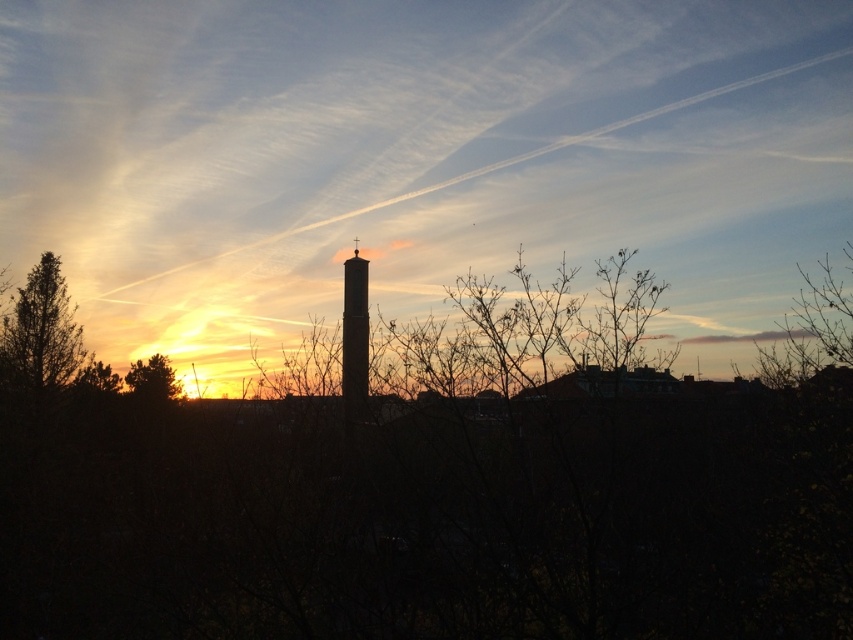
Question: Can you confirm if green textured tree at left is positioned above bare branches at right?

Choices:
 (A) no
 (B) yes

Answer: (A)

Question: Does bare branches at right have a smaller size compared to green leafy tree at left?

Choices:
 (A) yes
 (B) no

Answer: (B)

Question: Among these objects, which one is farthest from the camera?

Choices:
 (A) black matte chimney at center
 (B) green leafy tree at left
 (C) bare branches at right

Answer: (B)

Question: Among these points, which one is nearest to the camera?

Choices:
 (A) (352, 403)
 (B) (161, 376)
 (C) (795, 342)

Answer: (C)

Question: Can you confirm if bare branches at right is positioned below black matte chimney at center?

Choices:
 (A) no
 (B) yes

Answer: (A)

Question: Considering the real-world distances, which object is closest to the green leafy tree at left?

Choices:
 (A) black matte chimney at center
 (B) green textured tree at left
 (C) bare branches at right

Answer: (B)